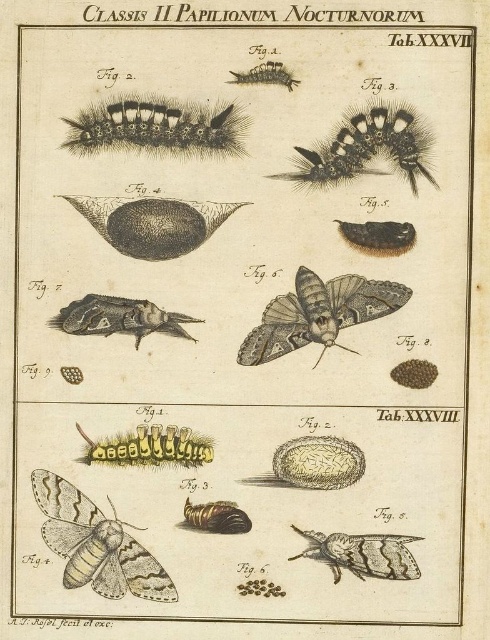
Which is in front, point (128, 580) or point (361, 540)?

Point (361, 540) is in front.

Does point (51, 522) come closer to viewer compared to point (380, 556)?

Yes, it is.

Measure the distance between point (119, 563) and camera.

Point (119, 563) is 12.18 meters away from camera.

I want to click on gray striped caterpillar at lower left, so click(x=96, y=545).

Is hairy brown caterpillar at upper center thinner than brown fuzzy caterpillar at center?

No, hairy brown caterpillar at upper center is not thinner than brown fuzzy caterpillar at center.

Does hairy brown caterpillar at upper center have a lesser height compared to brown fuzzy caterpillar at center?

Yes, hairy brown caterpillar at upper center is shorter than brown fuzzy caterpillar at center.

At what (x,y) coordinates should I click in order to perform the action: click on hairy brown caterpillar at upper center. Please return your answer as a coordinate pair (x, y). Looking at the image, I should click on (156, 129).

Does hairy brown caterpillar at upper center appear on the left side of shiny brown caterpillar at center?

Indeed, hairy brown caterpillar at upper center is positioned on the left side of shiny brown caterpillar at center.

Between hairy brown caterpillar at upper center and shiny brown caterpillar at center, which one appears on the left side from the viewer's perspective?

hairy brown caterpillar at upper center is more to the left.

At what (x,y) coordinates should I click in order to perform the action: click on hairy brown caterpillar at upper center. Please return your answer as a coordinate pair (x, y). Looking at the image, I should click on (156, 129).

At what (x,y) coordinates should I click in order to perform the action: click on hairy brown caterpillar at upper center. Please return your answer as a coordinate pair (x, y). Looking at the image, I should click on click(156, 129).